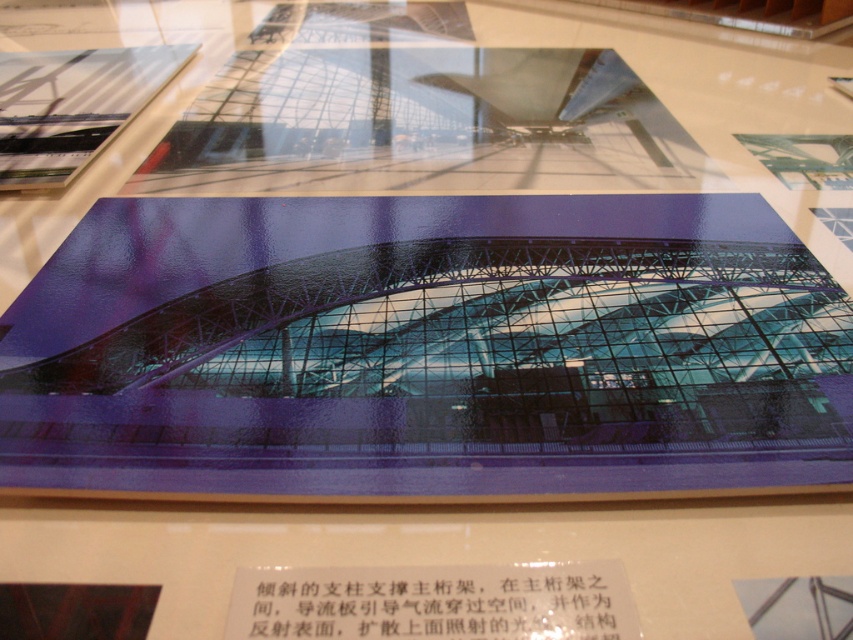
You are an interior designer reviewing architectural photos displayed on a reflective surface. You notice the white paper at center and the transparent glass structure at upper left. Which object would you need to handle with more care to avoid damaging its surface?

The transparent glass structure at upper left requires more care because it is larger and might be more prone to scratches or damage on its surface compared to the smaller white paper at center.

You are an art curator arranging an exhibition. You need to place a small decorative item on the white paper at center without obstructing the view of the transparent glass structure at upper left. Is this possible given their positions?

The white paper at center is positioned under the transparent glass structure at upper left, so placing a small decorative item on the white paper at center would not obstruct the view of the transparent glass structure at upper left since the glass is above it.

You are an architect reviewing a display of architectural photos. You notice the white paper at center and the transparent glass structure at upper left. Which object has a greater height in the image?

The transparent glass structure at upper left is taller than the white paper at center.